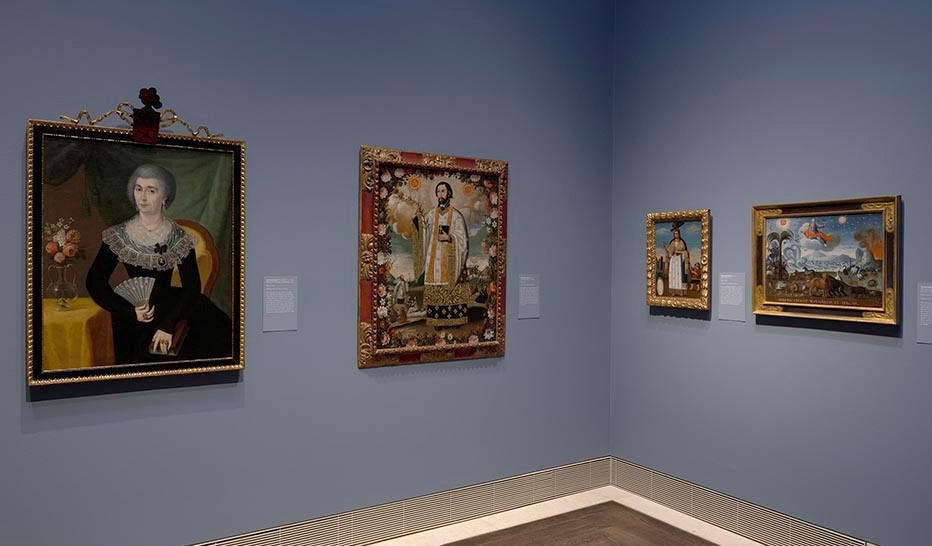
Find the location of a particular element. The image size is (932, 546). fan is located at coordinates (141, 287).